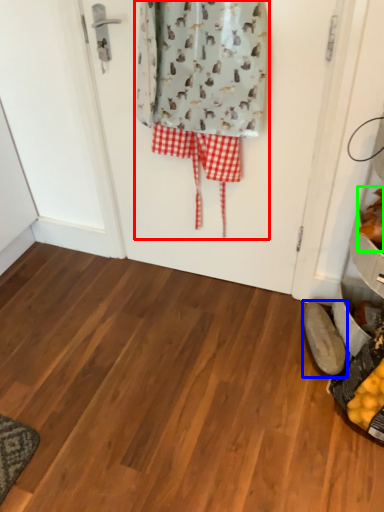
Question: Based on their relative distances, which object is farther from laundry (highlighted by a red box)? Choose from footwear (highlighted by a blue box) and food (highlighted by a green box).

Choices:
 (A) footwear
 (B) food

Answer: (A)